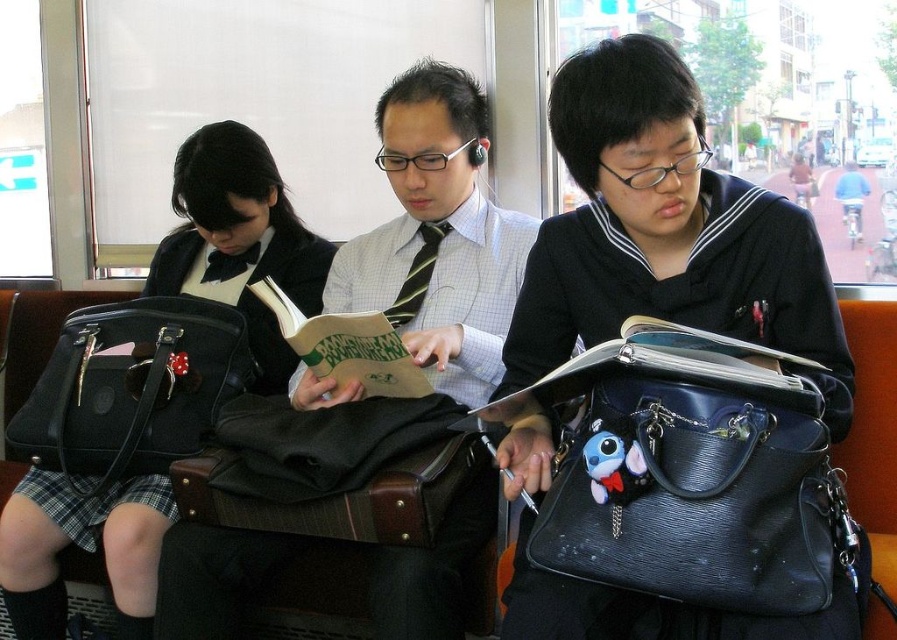
You are a passenger on a train and you want to put your matte black bag at left and hardcover book at center into a small overhead compartment. Can you fit both items side by side in the compartment?

The matte black bag at left is positioned on the left side of the hardcover book at center, but their combined width may exceed the compartment size. Check the compartment dimensions first.

You are standing in front of the train seat and need to place two stickers on the points labeled as point (645, 120) and point (196, 371). Which point should you place the sticker closer to your face?

Point (645, 120) is closer to the viewer than point (196, 371), so you should place the sticker on point (645, 120) closer to your face.

You are a passenger on a train and need to place your phone between the leather handbag at center and the hardcover book at center. Based on their positions, where should you place it?

The leather handbag at center is to the right of the hardcover book at center, so place your phone to the right of the hardcover book at center but left of the leather handbag at center.